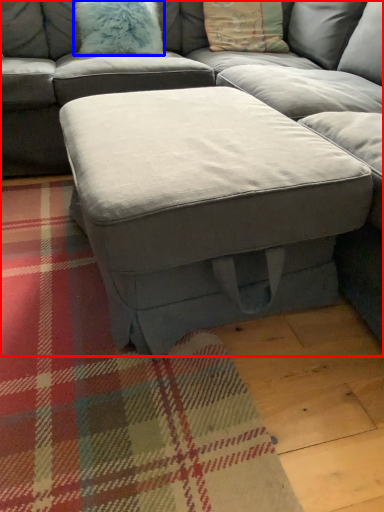
Question: Which of the following is the farthest to the observer, studio couch (highlighted by a red box) or pillow (highlighted by a blue box)?

Choices:
 (A) studio couch
 (B) pillow

Answer: (B)